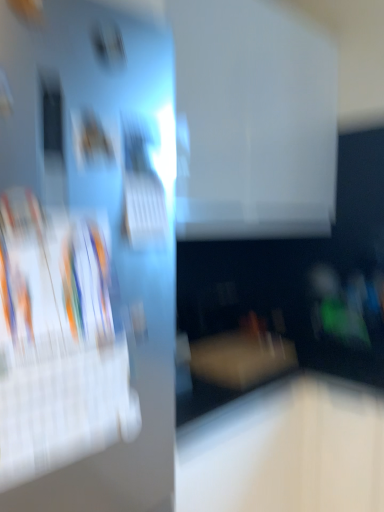
Question: Is white glossy magazine at left situated inside matte wood coffee table at center or outside?

Choices:
 (A) inside
 (B) outside

Answer: (B)

Question: From a real-world perspective, is white glossy magazine at left positioned above or below matte wood coffee table at center?

Choices:
 (A) above
 (B) below

Answer: (A)

Question: Is white glossy magazine at left in front of or behind matte wood coffee table at center in the image?

Choices:
 (A) front
 (B) behind

Answer: (A)

Question: From the image's perspective, is matte wood coffee table at center above or below white glossy magazine at left?

Choices:
 (A) above
 (B) below

Answer: (B)

Question: Considering the positions of matte wood coffee table at center and white glossy magazine at left in the image, is matte wood coffee table at center taller or shorter than white glossy magazine at left?

Choices:
 (A) short
 (B) tall

Answer: (A)

Question: Based on their sizes in the image, would you say matte wood coffee table at center is bigger or smaller than white glossy magazine at left?

Choices:
 (A) small
 (B) big

Answer: (A)

Question: Which is correct: matte wood coffee table at center is inside white glossy magazine at left, or outside of it?

Choices:
 (A) inside
 (B) outside

Answer: (B)